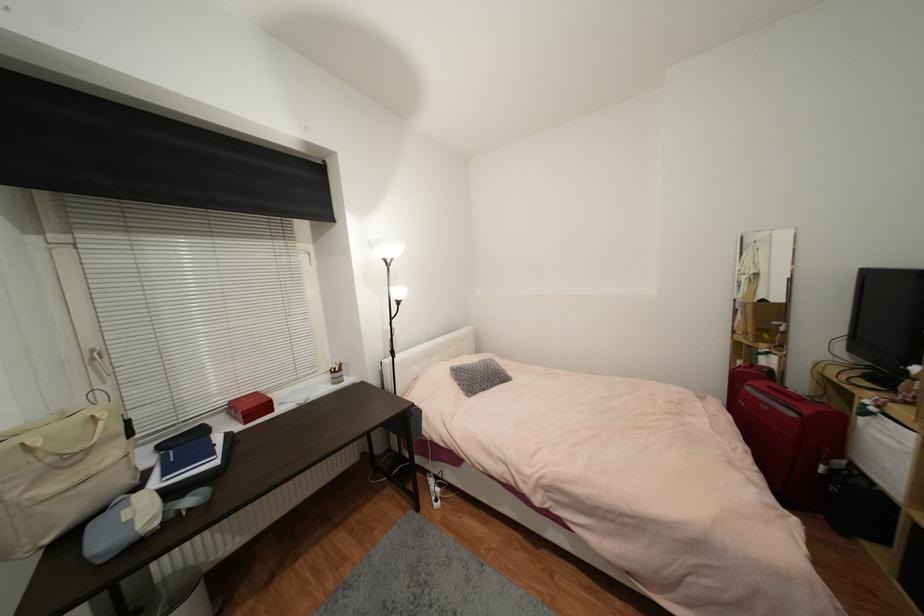
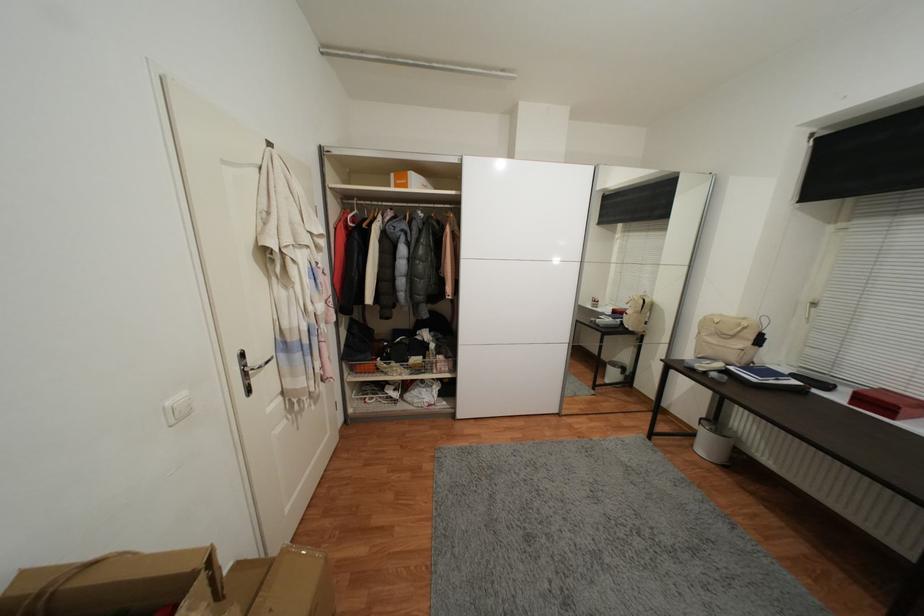
Locate, in the second image, the point that corresponds to point 222,464 in the first image.

(759, 381)